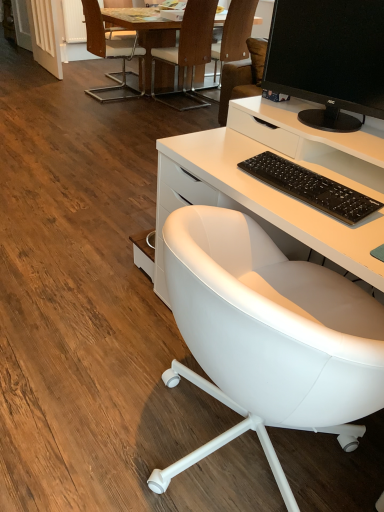
You are a GUI agent. You are given a task and a screenshot of the screen. Output one action in this format:
    pyautogui.click(x=<x>, y=<y>)
    Task: Click on the vacant space that is to the left of white leather chair at center, the fourth chair in the back-to-front sequence
    Image resolution: width=384 pixels, height=512 pixels.
    Given the screenshot: What is the action you would take?
    pyautogui.click(x=90, y=333)